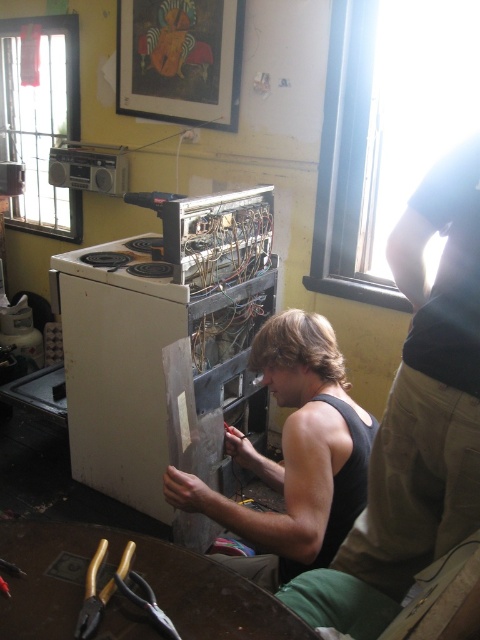
Does black tank top at center lie in front of black matte tank top at center?

Yes.

Can you confirm if black tank top at center is positioned to the left of black matte tank top at center?

In fact, black tank top at center is to the right of black matte tank top at center.

Is point (396, 529) positioned in front of point (204, 486)?

Yes, it is.

Locate an element on the screen. The height and width of the screenshot is (640, 480). black tank top at center is located at coordinates (417, 417).

Is white matte stove at center positioned behind gold metallic pliers at lower left?

Yes, white matte stove at center is behind gold metallic pliers at lower left.

Is white matte stove at center to the right of gold metallic pliers at lower left from the viewer's perspective?

Correct, you'll find white matte stove at center to the right of gold metallic pliers at lower left.

Find the location of a particular element. white matte stove at center is located at coordinates (167, 348).

Can you confirm if black tank top at center is bigger than gold metallic pliers at lower left?

Indeed, black tank top at center has a larger size compared to gold metallic pliers at lower left.

Who is lower down, black tank top at center or gold metallic pliers at lower left?

gold metallic pliers at lower left

Find the location of a particular element. The height and width of the screenshot is (640, 480). black tank top at center is located at coordinates (417, 417).